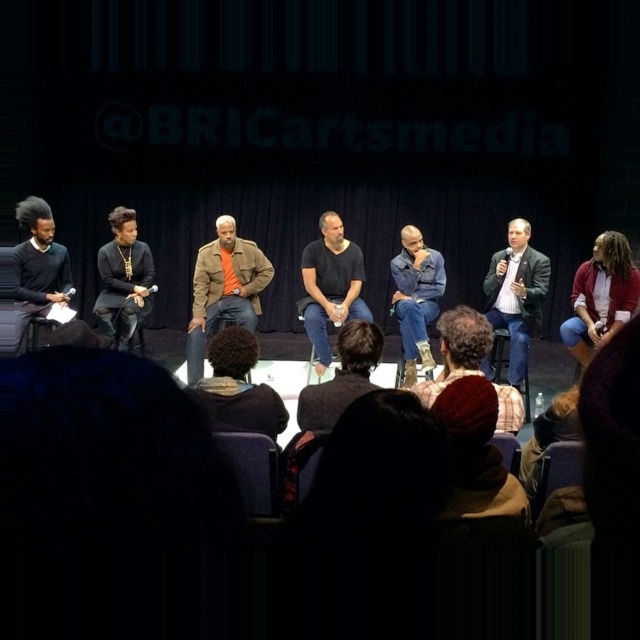
You are a photographer positioned at the back of the audience. You want to capture a clear photo of the dark brown hair at lower center and denim jeans at center. Considering their heights, which object should you focus on first to ensure both are in frame?

The dark brown hair at lower center has a lesser height compared to denim jeans at center, so you should focus on the denim jeans at center first to ensure both are in frame.

You are sitting in the front row of the audience and notice two items on the stage. One is a knitted red hat at lower center and the other is a brown leather jacket at center. If you want to reach both items without moving from your seat, which item is closer to you?

The knitted red hat at lower center is 11.90 feet away from the brown leather jacket at center. Since you are in the front row, the knitted red hat at lower center is closer to you than the brown leather jacket at center.

You are an attendee at the panel discussion and want to locate the knitted red hat at lower center. According to the coordinates provided, where exactly is it positioned?

The knitted red hat at lower center is located at point 0.708 on the x axis and 0.745 on the y axis.